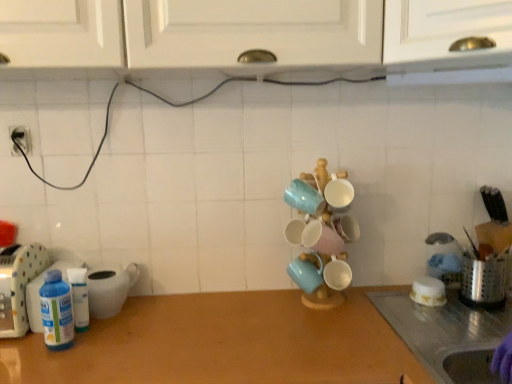
Question: Should I look upward or downward to see metallic silver utensil holder at right, the first appliance from the right?

Choices:
 (A) up
 (B) down

Answer: (B)

Question: Considering the relative sizes of metallic silver utensil holder at right, the 4th appliance positioned from the left, and wooden at center in the image provided, is metallic silver utensil holder at right, the 4th appliance positioned from the left, shorter than wooden at center?

Choices:
 (A) yes
 (B) no

Answer: (B)

Question: Is metallic silver utensil holder at right, the 4th appliance positioned from the left, wider than wooden at center?

Choices:
 (A) yes
 (B) no

Answer: (B)

Question: Is metallic silver utensil holder at right, the 4th appliance positioned from the left, beside wooden at center?

Choices:
 (A) no
 (B) yes

Answer: (A)

Question: Does metallic silver utensil holder at right, the 4th appliance positioned from the left, have a smaller size compared to wooden at center?

Choices:
 (A) yes
 (B) no

Answer: (A)

Question: From the image's perspective, is metallic silver utensil holder at right, the 4th appliance positioned from the left, on wooden at center?

Choices:
 (A) yes
 (B) no

Answer: (A)

Question: Is metallic silver utensil holder at right, the 4th appliance positioned from the left, located outside wooden at center?

Choices:
 (A) yes
 (B) no

Answer: (A)

Question: Does matte blue mug at center, the first tableware viewed from the left, appear on the right side of white plastic bottle at left, which is counted as the fourth appliance, starting from the right?

Choices:
 (A) yes
 (B) no

Answer: (A)

Question: Is white plastic bottle at left, the 1th appliance in the left-to-right sequence, surrounded by matte blue mug at center, the 3th tableware from the right?

Choices:
 (A) yes
 (B) no

Answer: (B)

Question: Can you confirm if matte blue mug at center, the 3th tableware from the right, is wider than white plastic bottle at left, which is counted as the fourth appliance, starting from the right?

Choices:
 (A) no
 (B) yes

Answer: (A)

Question: From the image's perspective, is matte blue mug at center, the first tableware viewed from the left, over white plastic bottle at left, the 1th appliance in the left-to-right sequence?

Choices:
 (A) no
 (B) yes

Answer: (B)

Question: Is the depth of matte blue mug at center, the 3th tableware from the right, greater than that of white plastic bottle at left, the 1th appliance in the left-to-right sequence?

Choices:
 (A) no
 (B) yes

Answer: (B)

Question: Would you say matte blue mug at center, the 3th tableware from the right, is a long distance from white plastic bottle at left, which is counted as the fourth appliance, starting from the right?

Choices:
 (A) yes
 (B) no

Answer: (B)

Question: Is matte ceramic mugs at center, the second tableware viewed from the right, further to the viewer compared to metallic silver utensil holder at right, the first appliance from the right?

Choices:
 (A) no
 (B) yes

Answer: (A)